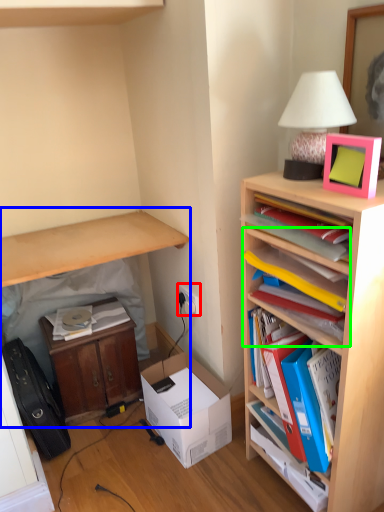
Question: Which is farther away from electric outlet (highlighted by a red box)? table (highlighted by a blue box) or shelf (highlighted by a green box)?

Choices:
 (A) table
 (B) shelf

Answer: (B)